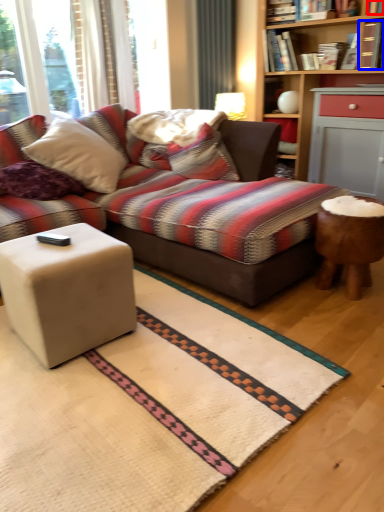
Question: Which object appears closest to the camera in this image, book (highlighted by a red box) or book (highlighted by a blue box)?

Choices:
 (A) book
 (B) book

Answer: (A)